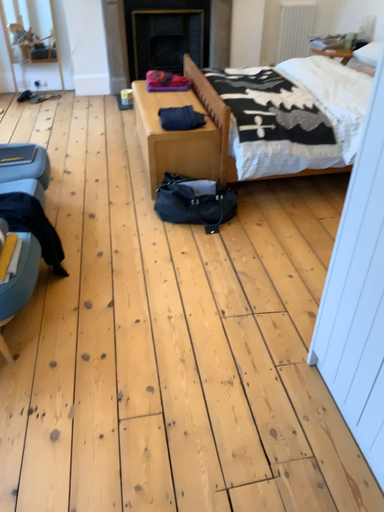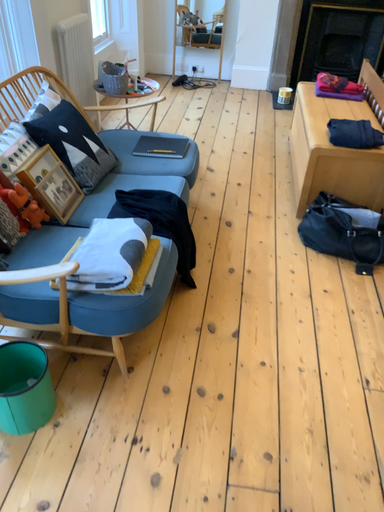
Question: How did the camera likely rotate when shooting the video?

Choices:
 (A) rotated left
 (B) rotated right

Answer: (A)